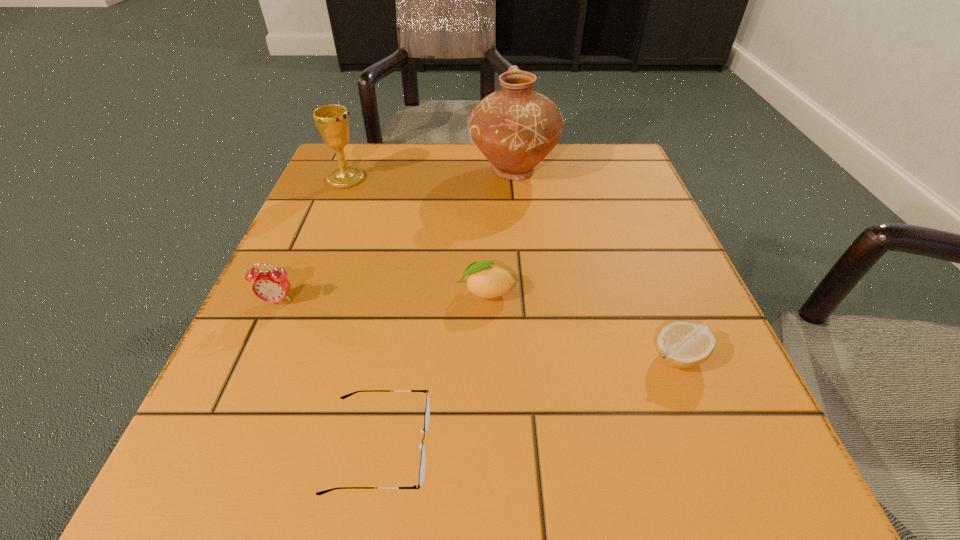
Locate which object is the fourth closest to the chalice. Please provide its 2D coordinates. Your answer should be formatted as a tuple, i.e. [(x, y)], where the tuple contains the x and y coordinates of a point satisfying the conditions above.

[(427, 409)]

Select which object is the closest to the tallest object. Please provide its 2D coordinates. Your answer should be formatted as a tuple, i.e. [(x, y)], where the tuple contains the x and y coordinates of a point satisfying the conditions above.

[(332, 121)]

Identify the location of vacant space that satisfies the following two spatial constraints: 1. with leaves positioned above the third shortest object; 2. on the face of the fourth shortest object. (487, 302).

Identify the location of vacant region that satisfies the following two spatial constraints: 1. with leaves positioned above the left lemon; 2. on the face of the fourth shortest object. (487, 302).

Locate an element on the screen. The width and height of the screenshot is (960, 540). vacant position in the image that satisfies the following two spatial constraints: 1. with leaves positioned above the third shortest object; 2. on the face of the alarm clock is located at coordinates coord(487,302).

Find the location of a particular element. blank area in the image that satisfies the following two spatial constraints: 1. on the face of the right lemon; 2. on the right side of the alarm clock is located at coordinates point(253,356).